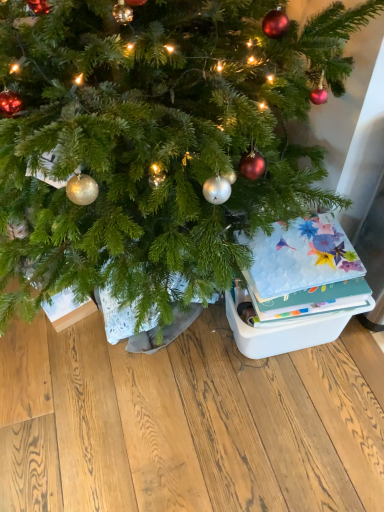
Image resolution: width=384 pixels, height=512 pixels. I want to click on green matte christmas tree at center, so click(x=156, y=138).

What is the approximate width of floral-patterned paper at right?

floral-patterned paper at right is 12.37 inches wide.

This screenshot has width=384, height=512. What do you see at coordinates (288, 330) in the screenshot?
I see `white plastic storage box at lower right` at bounding box center [288, 330].

At what (x,y) coordinates should I click in order to perform the action: click on green matte christmas tree at center. Please return your answer as a coordinate pair (x, y). Looking at the image, I should click on (156, 138).

Would you say green matte christmas tree at center contains white plastic storage box at lower right?

Definitely not — white plastic storage box at lower right is not inside green matte christmas tree at center.

Identify the location of storage box that is below the green matte christmas tree at center (from the image's perspective). This screenshot has width=384, height=512. (288, 330).

Between green matte christmas tree at center and white plastic storage box at lower right, which one has more height?

With more height is white plastic storage box at lower right.

Is green matte christmas tree at center positioned with its back to white plastic storage box at lower right?

No, green matte christmas tree at center is not facing away from white plastic storage box at lower right.

Which of these two, green matte christmas tree at center or floral-patterned paper at right, is bigger?

Bigger between the two is green matte christmas tree at center.

Is green matte christmas tree at center positioned beyond the bounds of floral-patterned paper at right?

That's correct, green matte christmas tree at center is outside of floral-patterned paper at right.

From the image's perspective, between green matte christmas tree at center and floral-patterned paper at right, which one is located above?

green matte christmas tree at center is shown above in the image.

From a real-world perspective, who is located lower, green matte christmas tree at center or floral-patterned paper at right?

green matte christmas tree at center.

Measure the distance from white plastic storage box at lower right to floral-patterned paper at right.

5.22 inches.

From a real-world perspective, is white plastic storage box at lower right on top of floral-patterned paper at right?

No, from a real-world perspective, white plastic storage box at lower right is not over floral-patterned paper at right

Which point is more forward, (274, 350) or (311, 222)?

The point (311, 222) is closer to the camera.

From the image's perspective, is white plastic storage box at lower right located above or below floral-patterned paper at right?

From the image's perspective, white plastic storage box at lower right appears below floral-patterned paper at right.

Does white plastic storage box at lower right turn towards green matte christmas tree at center?

No.

Who is taller, white plastic storage box at lower right or green matte christmas tree at center?

With more height is white plastic storage box at lower right.

From a real-world perspective, which is physically below, white plastic storage box at lower right or green matte christmas tree at center?

In real-world perspective, green matte christmas tree at center is lower.

The height and width of the screenshot is (512, 384). Find the location of `storage box behind the green matte christmas tree at center`. storage box behind the green matte christmas tree at center is located at coordinates (288, 330).

Measure the distance from floral-patterned paper at right to white plastic storage box at lower right.

floral-patterned paper at right and white plastic storage box at lower right are 5.22 inches apart.

Which of these two, floral-patterned paper at right or white plastic storage box at lower right, is wider?

Wider between the two is white plastic storage box at lower right.

Is white plastic storage box at lower right at the back of floral-patterned paper at right?

No, floral-patterned paper at right is not facing away from white plastic storage box at lower right.

Choose the correct answer: Is floral-patterned paper at right inside green matte christmas tree at center or outside it?

The correct answer is: outside.

Can you tell me how much floral-patterned paper at right and green matte christmas tree at center differ in facing direction?

174 degrees separate the facing orientations of floral-patterned paper at right and green matte christmas tree at center.

Can you see floral-patterned paper at right touching green matte christmas tree at center?

They are not placed beside each other.

Is floral-patterned paper at right oriented away from green matte christmas tree at center?

No, floral-patterned paper at right is not facing away from green matte christmas tree at center.

The image size is (384, 512). In order to click on christmas tree below the white plastic storage box at lower right (from a real-world perspective) in this screenshot , I will do `click(156, 138)`.

Locate an element on the screen. The width and height of the screenshot is (384, 512). christmas tree located above the floral-patterned paper at right (from the image's perspective) is located at coordinates (156, 138).

Based on their spatial positions, is green matte christmas tree at center or white plastic storage box at lower right further from floral-patterned paper at right?

green matte christmas tree at center is further to floral-patterned paper at right.

From the image, which object appears to be nearer to green matte christmas tree at center, floral-patterned paper at right or white plastic storage box at lower right?

floral-patterned paper at right.

When comparing their distances from white plastic storage box at lower right, does floral-patterned paper at right or green matte christmas tree at center seem further?

green matte christmas tree at center is further to white plastic storage box at lower right.

From the picture: Which object lies nearer to the anchor point white plastic storage box at lower right, green matte christmas tree at center or floral-patterned paper at right?

Among the two, floral-patterned paper at right is located nearer to white plastic storage box at lower right.

Looking at the image, which one is located closer to green matte christmas tree at center, white plastic storage box at lower right or floral-patterned paper at right?

floral-patterned paper at right is closer to green matte christmas tree at center.

From the image, which object appears to be farther from floral-patterned paper at right, white plastic storage box at lower right or green matte christmas tree at center?

Among the two, green matte christmas tree at center is located further to floral-patterned paper at right.

This screenshot has height=512, width=384. What are the coordinates of `christmas card located between green matte christmas tree at center and white plastic storage box at lower right in the left-right direction` in the screenshot? It's located at (304, 269).